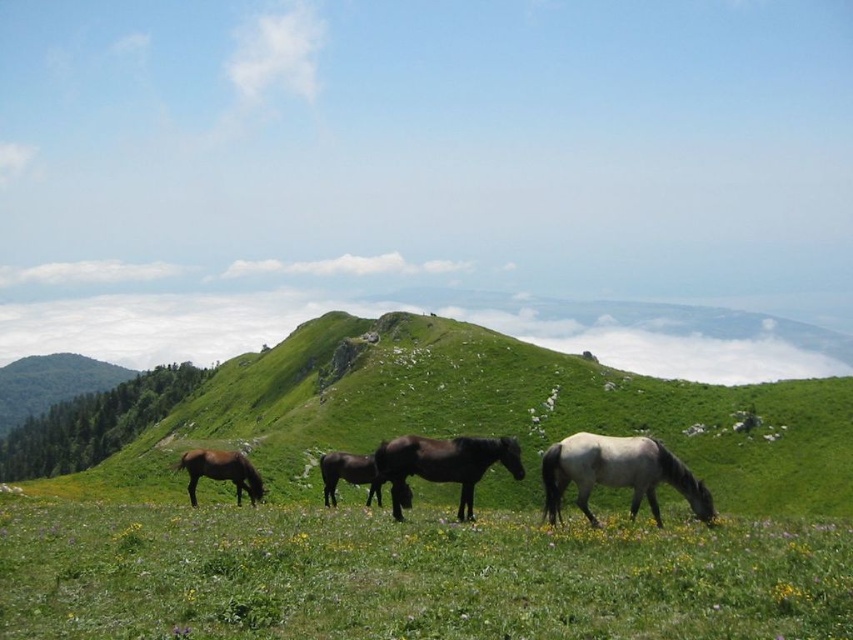
Locate an element on the screen. Image resolution: width=853 pixels, height=640 pixels. brown glossy horse at lower left is located at coordinates (221, 472).

Is brown glossy horse at lower left further to the viewer compared to dark brown glossy horse at center?

Yes, it is behind dark brown glossy horse at center.

Find the location of `brown glossy horse at lower left`. brown glossy horse at lower left is located at coordinates (221, 472).

Can you confirm if green grassy field at lower center is positioned to the left of gray matte horse at right?

Correct, you'll find green grassy field at lower center to the left of gray matte horse at right.

Is point (524, 628) farther from camera compared to point (706, 500)?

That is False.

Does point (13, 632) come closer to viewer compared to point (555, 468)?

Yes, it is in front of point (555, 468).

I want to click on green grassy field at lower center, so click(410, 577).

Can you confirm if green grassy hillside at center is taller than shiny dark brown horse at center?

Correct, green grassy hillside at center is much taller as shiny dark brown horse at center.

Is green grassy hillside at center to the left of shiny dark brown horse at center from the viewer's perspective?

Yes, green grassy hillside at center is to the left of shiny dark brown horse at center.

The height and width of the screenshot is (640, 853). I want to click on green grassy hillside at center, so click(x=483, y=413).